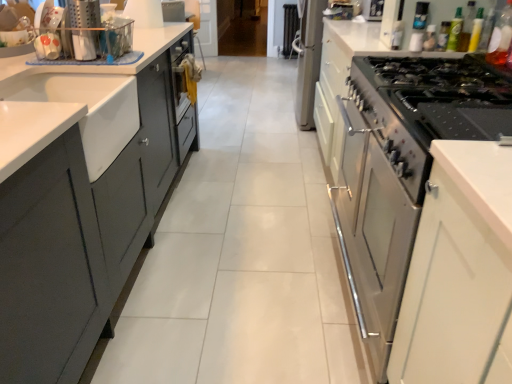
Question: Considering the relative sizes of translucent plastic bottle at upper right, which is counted as the 4th bottle, starting from the left, and matte plastic utensil holder at upper left in the image provided, is translucent plastic bottle at upper right, which is counted as the 4th bottle, starting from the left, smaller than matte plastic utensil holder at upper left?

Choices:
 (A) no
 (B) yes

Answer: (B)

Question: Is matte plastic utensil holder at upper left a part of translucent plastic bottle at upper right, which is counted as the 4th bottle, starting from the left?

Choices:
 (A) yes
 (B) no

Answer: (B)

Question: Can you confirm if translucent plastic bottle at upper right, which is counted as the 4th bottle, starting from the left, is taller than matte plastic utensil holder at upper left?

Choices:
 (A) yes
 (B) no

Answer: (A)

Question: Could you tell me if translucent plastic bottle at upper right, which is counted as the 4th bottle, starting from the left, is turned towards matte plastic utensil holder at upper left?

Choices:
 (A) yes
 (B) no

Answer: (A)

Question: Is translucent plastic bottle at upper right, the third bottle viewed from the right, touching matte plastic utensil holder at upper left?

Choices:
 (A) no
 (B) yes

Answer: (A)

Question: Is white matte sink at left in front of or behind green glass bottle at upper right, the fourth bottle viewed from the right, in the image?

Choices:
 (A) behind
 (B) front

Answer: (B)

Question: Is point (73, 102) closer or farther from the camera than point (465, 28)?

Choices:
 (A) closer
 (B) farther

Answer: (A)

Question: Is white matte sink at left taller or shorter than green glass bottle at upper right, the fourth bottle viewed from the right?

Choices:
 (A) short
 (B) tall

Answer: (B)

Question: Is white matte sink at left inside the boundaries of green glass bottle at upper right, the third bottle from the left, or outside?

Choices:
 (A) outside
 (B) inside

Answer: (A)

Question: Visually, is transparent plastic bottle at upper right, the 6th bottle in the left-to-right sequence, positioned to the left or to the right of translucent plastic bottle at upper right, which is counted as the 4th bottle, starting from the left?

Choices:
 (A) right
 (B) left

Answer: (A)

Question: Is transparent plastic bottle at upper right, placed as the 1th bottle when sorted from right to left, spatially inside translucent plastic bottle at upper right, the third bottle viewed from the right, or outside of it?

Choices:
 (A) outside
 (B) inside

Answer: (A)

Question: Considering their positions, is transparent plastic bottle at upper right, placed as the 1th bottle when sorted from right to left, located in front of or behind translucent plastic bottle at upper right, which is counted as the 4th bottle, starting from the left?

Choices:
 (A) behind
 (B) front

Answer: (A)

Question: From their relative heights in the image, would you say transparent plastic bottle at upper right, placed as the 1th bottle when sorted from right to left, is taller or shorter than translucent plastic bottle at upper right, the third bottle viewed from the right?

Choices:
 (A) short
 (B) tall

Answer: (A)

Question: Considering the positions of green matte bottle at upper right, which is the second bottle in left-to-right order, and green glass bottle at upper right, the third bottle from the left, in the image, is green matte bottle at upper right, which is the second bottle in left-to-right order, bigger or smaller than green glass bottle at upper right, the third bottle from the left,?

Choices:
 (A) small
 (B) big

Answer: (A)

Question: Would you say green matte bottle at upper right, which is the second bottle in left-to-right order, is to the left or to the right of green glass bottle at upper right, the third bottle from the left, in the picture?

Choices:
 (A) left
 (B) right

Answer: (A)